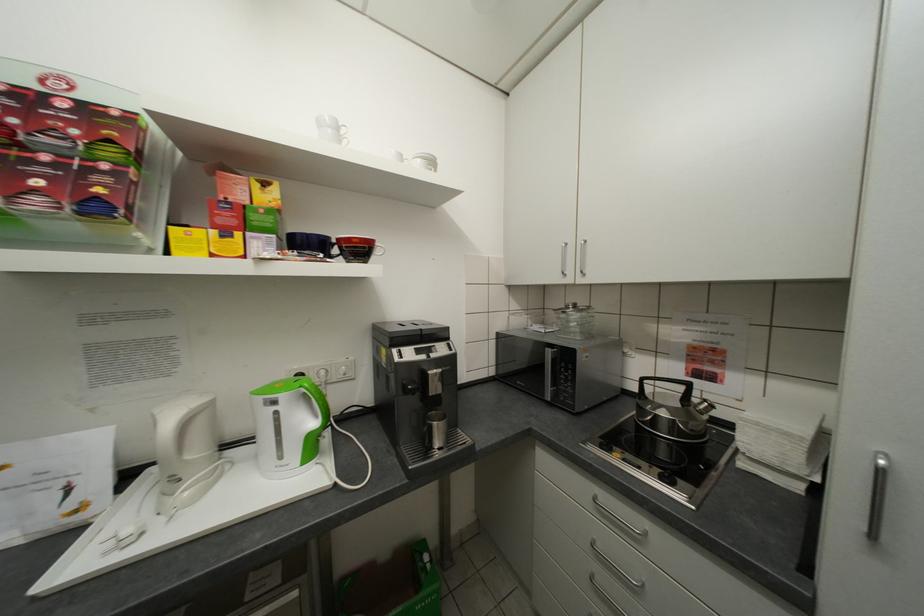
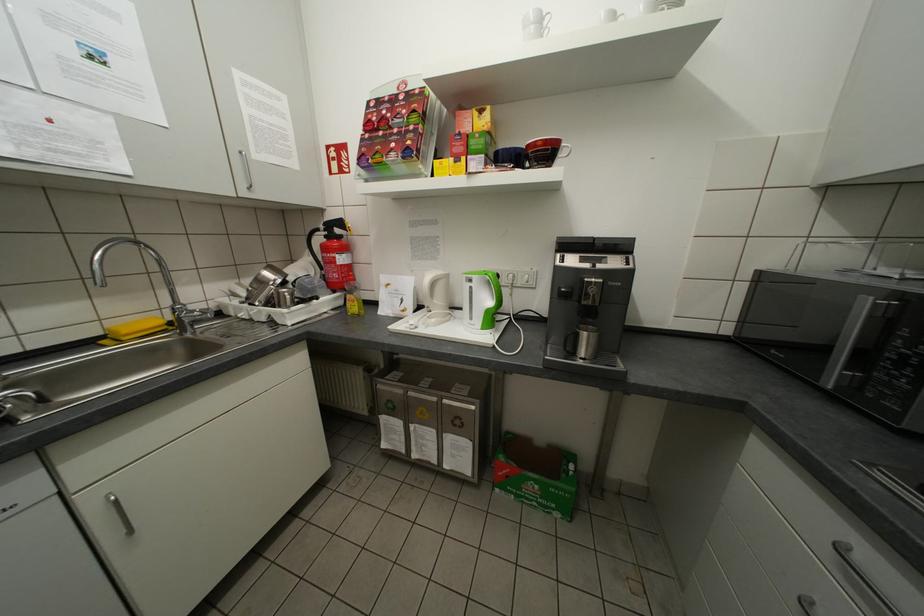
Find the pixel in the second image that matches point 362,241 in the first image.

(548, 144)